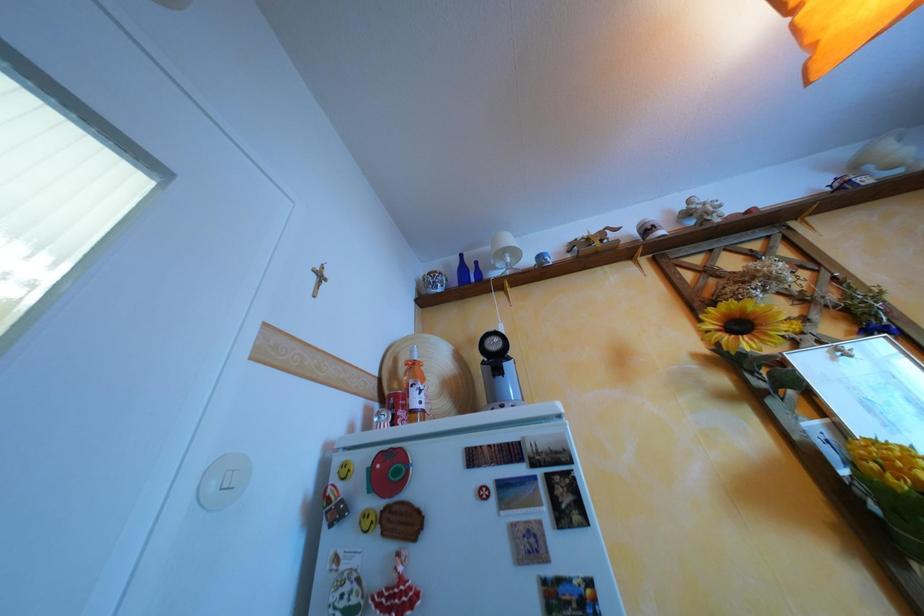
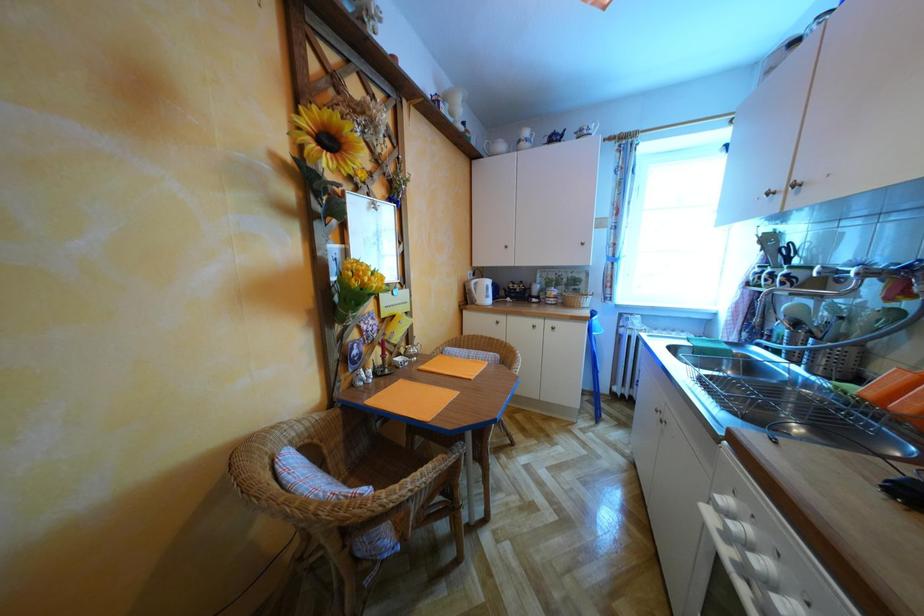
Question: The camera is either moving clockwise (left) or counter-clockwise (right) around the object. The first image is from the beginning of the video and the second image is from the end. Is the camera moving left or right when shooting the video?

Choices:
 (A) Left
 (B) Right

Answer: (A)